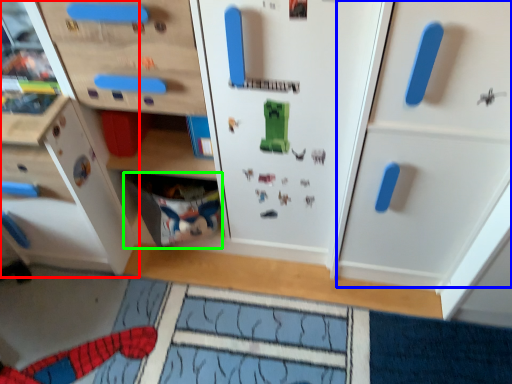
Question: Considering the real-world distances, which object is farthest from cabinetry (highlighted by a red box)? cabinetry (highlighted by a blue box) or drawer (highlighted by a green box)?

Choices:
 (A) cabinetry
 (B) drawer

Answer: (A)